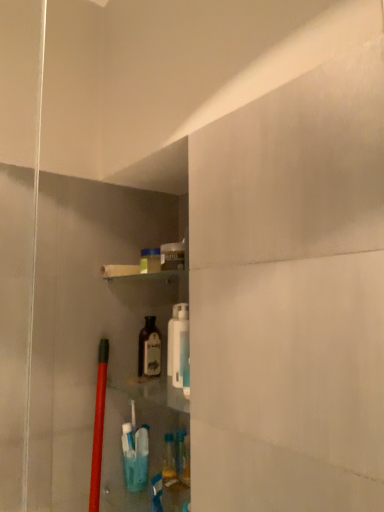
Question: Considering the relative sizes of translucent glass bottle at center and white plastic bottle at center in the image provided, is translucent glass bottle at center smaller than white plastic bottle at center?

Choices:
 (A) no
 (B) yes

Answer: (B)

Question: Is translucent glass bottle at center taller than white plastic bottle at center?

Choices:
 (A) yes
 (B) no

Answer: (B)

Question: Is translucent glass bottle at center bigger than white plastic bottle at center?

Choices:
 (A) no
 (B) yes

Answer: (A)

Question: Is white plastic bottle at center a part of translucent glass bottle at center?

Choices:
 (A) yes
 (B) no

Answer: (B)

Question: Does translucent glass bottle at center come behind white plastic bottle at center?

Choices:
 (A) yes
 (B) no

Answer: (A)

Question: Are translucent glass bottle at center and white plastic bottle at center far apart?

Choices:
 (A) yes
 (B) no

Answer: (B)

Question: Is translucent glass bottle at center completely or partially inside white plastic bottle at center?

Choices:
 (A) yes
 (B) no

Answer: (B)

Question: From a real-world perspective, is white plastic bottle at center physically below translucent glass bottle at center?

Choices:
 (A) yes
 (B) no

Answer: (B)

Question: Is white plastic bottle at center at the right side of translucent glass bottle at center?

Choices:
 (A) yes
 (B) no

Answer: (A)

Question: Is white plastic bottle at center further to the viewer compared to translucent glass bottle at center?

Choices:
 (A) yes
 (B) no

Answer: (B)

Question: Is white plastic bottle at center wider than translucent glass bottle at center?

Choices:
 (A) yes
 (B) no

Answer: (B)

Question: From a real-world perspective, is white plastic bottle at center physically above translucent glass bottle at center?

Choices:
 (A) yes
 (B) no

Answer: (A)

Question: From the image's perspective, is translucent glass bottle at center positioned above or below white plastic bottle at center?

Choices:
 (A) above
 (B) below

Answer: (B)